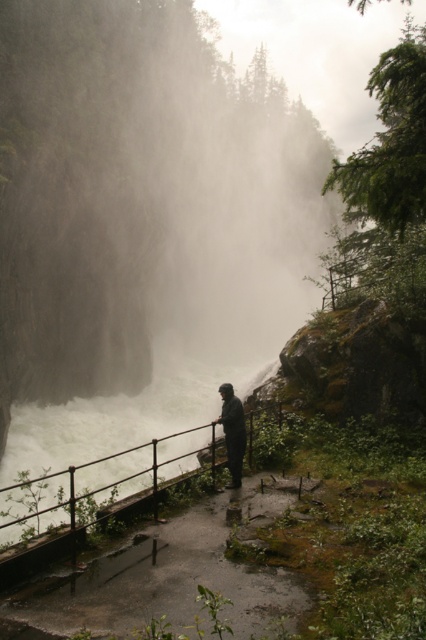
You are a hiker who wants to take a photo of the dark matte jacket at center while standing near the black metal railing at lower center. Given that your camera has a limited zoom, can you fit both objects into the frame without moving closer?

The black metal railing at lower center is larger in size than the dark matte jacket at center. Since the railing is bigger, it might block part of the jacket if you position yourself too close. To ensure both are visible, step back slightly to include more of the scene, allowing both objects to fit within the camera frame.

You are standing on the cliff path and want to get a better view of the waterfall. If you move forward towards the edge, will the dark matte jacket at center come between you and the black metal railing at lower center?

The black metal railing at lower center is closer to the viewer than the dark matte jacket at center. Moving forward towards the edge would mean the dark matte jacket at center would not come between you and the railing, as the railing is already closer to you.

Based on the photo, you are a hiker standing on the pathway near the black metal railing at lower center and the dark matte jacket at center. If you want to move closer to the cliff edge, which object should you move past first?

You should move past the black metal railing at lower center first because it is closer to the cliff edge than the dark matte jacket at center.